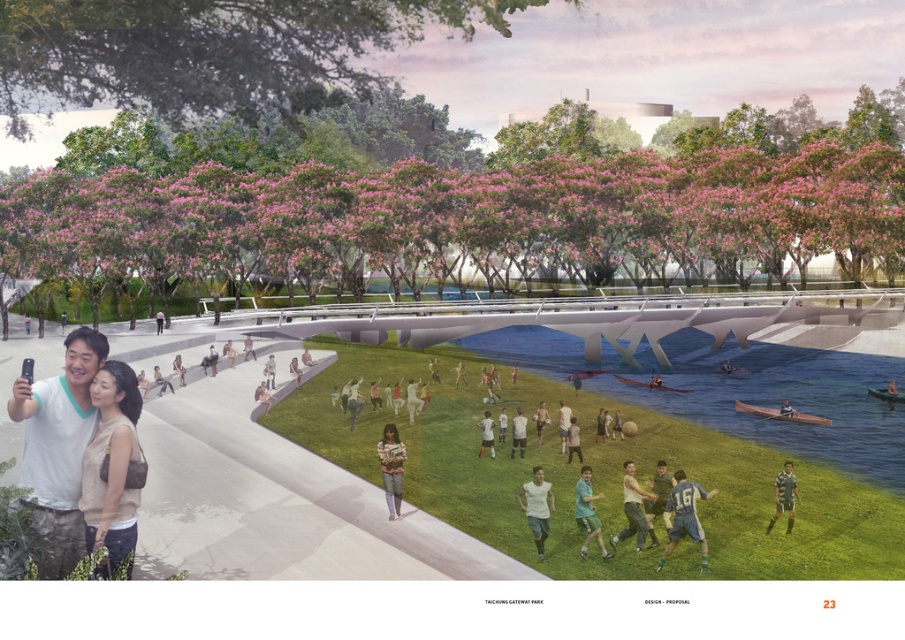
Question: Based on their relative distances, which object is nearer to the white cotton shirt at lower left?

Choices:
 (A) green leafy trees at center
 (B) gray fabric shirt at lower right

Answer: (B)

Question: In this image, where is green leafy trees at center located relative to light brown sweater at center?

Choices:
 (A) below
 (B) above

Answer: (B)

Question: Which of these objects is positioned closest to the green jersey at center?

Choices:
 (A) green leafy tree at upper center
 (B) beige fabric purse at lower left

Answer: (A)

Question: Does light brown sweater at center have a larger size compared to gray fabric shirt at lower right?

Choices:
 (A) yes
 (B) no

Answer: (A)

Question: Considering the real-world distances, which object is closest to the green jersey at center?

Choices:
 (A) gray fabric shirt at lower right
 (B) green leafy tree at upper center

Answer: (A)

Question: Can you confirm if green leafy trees at center is thinner than gray fabric shirt at lower right?

Choices:
 (A) yes
 (B) no

Answer: (B)